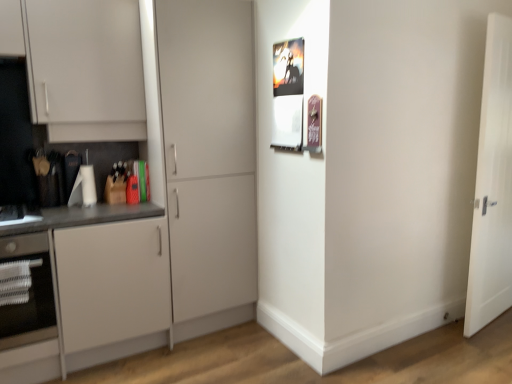
Identify the location of free spot in front of white wooden door at right, which is the first door from right to left. (486, 345).